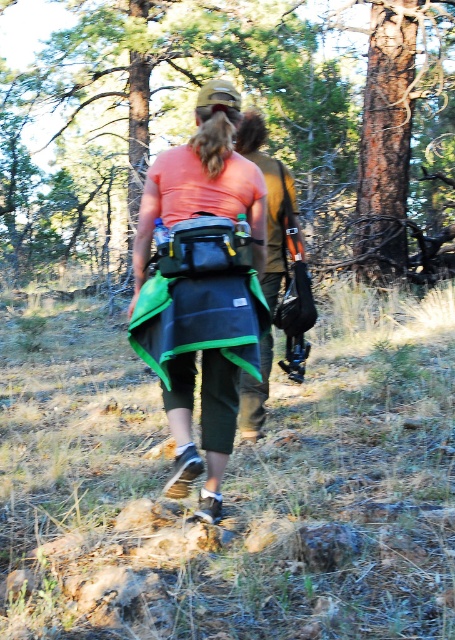
You are a hiker planning to take a shortcut through the forest. You notice the matte green backpack at center and the brown leather jacket at center. Which item is positioned to the left when viewed from your perspective?

The matte green backpack at center is to the left of the brown leather jacket at center, so the matte green backpack at center is positioned to the left.

You are a hiker trying to locate your matte green backpack at center in the forest. Based on the coordinates provided, where would you find it relative to the camera?

The matte green backpack at center is located at coordinates point (202, 285) relative to the camera.

You are a hiker who needs to access your water bottle quickly. You see the matte green backpack at center and the brown leather jacket at center. Which item is easier to reach without moving your arms?

The matte green backpack at center is positioned under the brown leather jacket at center, so it is more accessible without moving your arms since it is closer to your body.